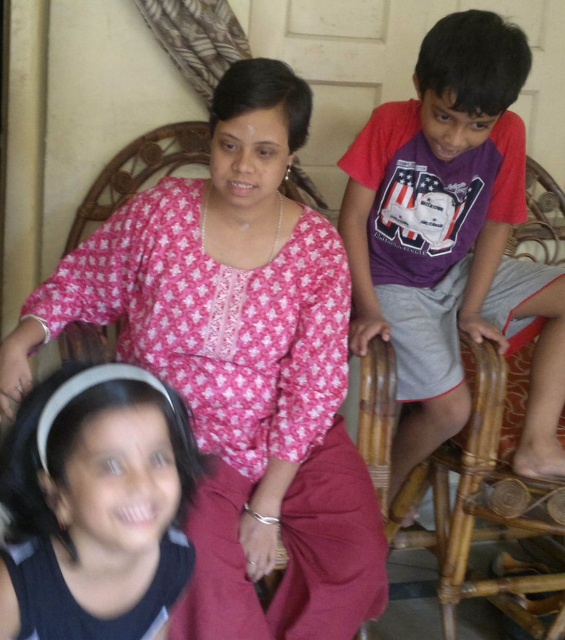
You are an interior designer analyzing the spatial layout of the scene. Where is the pink printed blouse at center located in terms of coordinates?

The pink printed blouse at center is located at coordinates point [240,365].

Based on the coordinates provided, where exactly is the pink printed blouse at center located in the image?

The pink printed blouse at center is located at point coordinates of 0.573 on the x axis and 0.425 on the y axis.